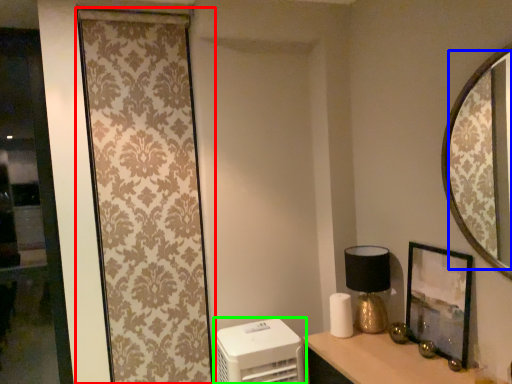
Question: Considering the real-world distances, which object is farthest from curtain (highlighted by a red box)? mirror (highlighted by a blue box) or appliance (highlighted by a green box)?

Choices:
 (A) mirror
 (B) appliance

Answer: (A)